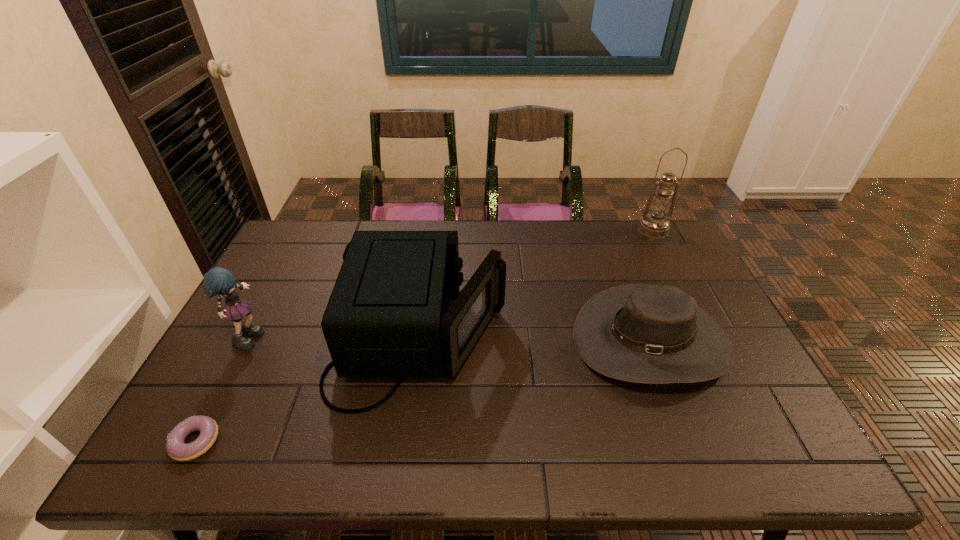
You are a GUI agent. You are given a task and a screenshot of the screen. Output one action in this format:
    pyautogui.click(x=<x>, y=<y>)
    Task: Click on the vacant space that satisfies the following two spatial constraints: 1. on the back side of the tallest object; 2. on the right side of the nearest object
    The width and height of the screenshot is (960, 540).
    Given the screenshot: What is the action you would take?
    pyautogui.click(x=305, y=230)

Identify the location of vacant space that satisfies the following two spatial constraints: 1. on the front side of the tallest object; 2. on the front-facing side of the rag doll. The image size is (960, 540). (708, 335).